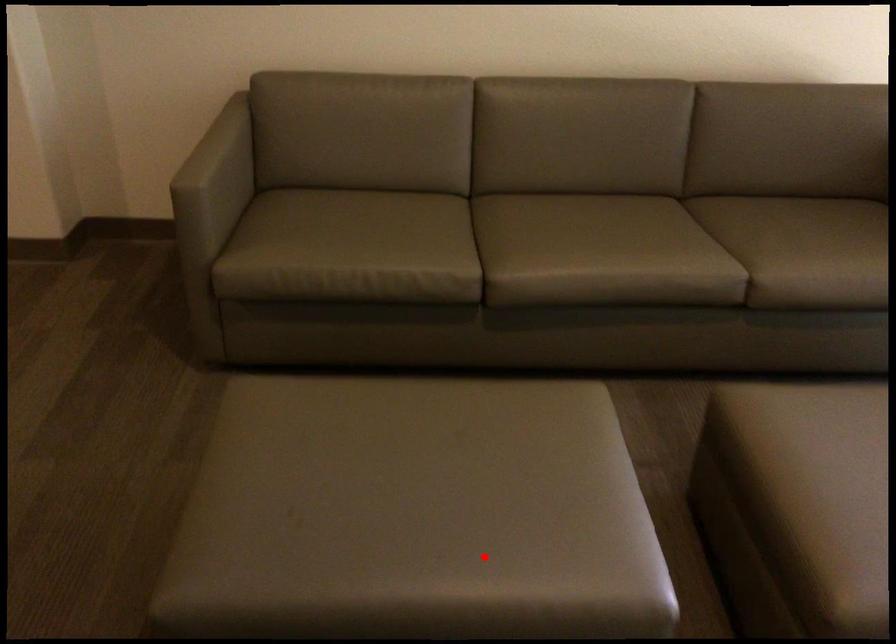
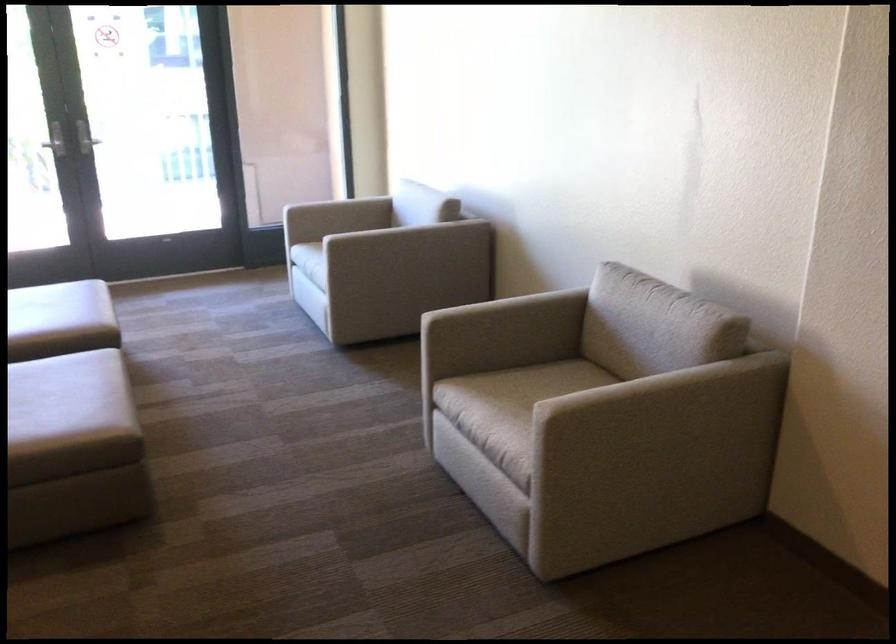
In the second image, find the point that corresponds to the highlighted location in the first image.

(65, 384)